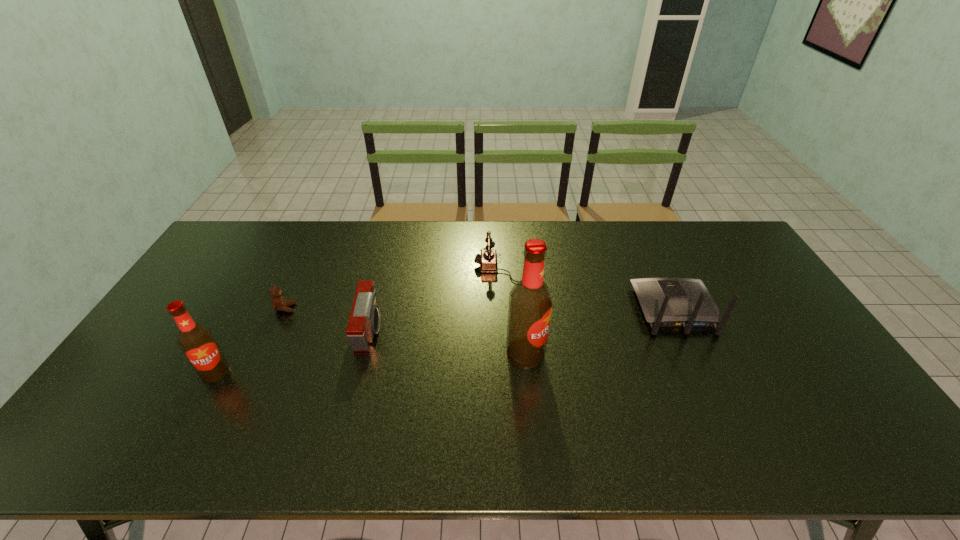
Find the location of a particular element. This screenshot has height=540, width=960. the shorter beer bottle is located at coordinates (197, 343).

Find the location of a particular element. The height and width of the screenshot is (540, 960). the second tallest object is located at coordinates (197, 343).

Find the location of a particular element. This screenshot has width=960, height=540. the taller beer bottle is located at coordinates (530, 305).

Identify the location of the tallest object. (530, 305).

Identify the location of camera. (364, 321).

The width and height of the screenshot is (960, 540). What are the coordinates of `the third shortest object` in the screenshot? It's located at (364, 321).

The width and height of the screenshot is (960, 540). Find the location of `the rightmost object`. the rightmost object is located at coordinates (666, 302).

Find the location of a particular element. This screenshot has width=960, height=540. router is located at coordinates (666, 302).

This screenshot has height=540, width=960. What are the coordinates of `telephone` in the screenshot? It's located at (488, 259).

Where is `teddy bear`? This screenshot has height=540, width=960. teddy bear is located at coordinates (279, 303).